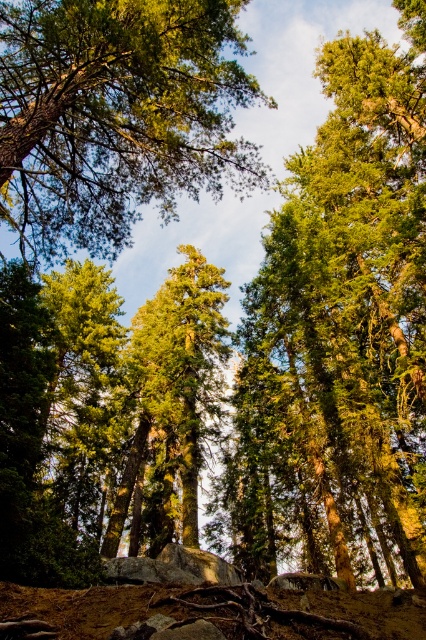
Does green textured tree at center appear on the left side of green rough bark tree at upper center?

No, green textured tree at center is not to the left of green rough bark tree at upper center.

Which is in front, point (414, 307) or point (39, 216)?

Point (39, 216) is more forward.

Where is `green textured tree at center`? The height and width of the screenshot is (640, 426). green textured tree at center is located at coordinates (342, 320).